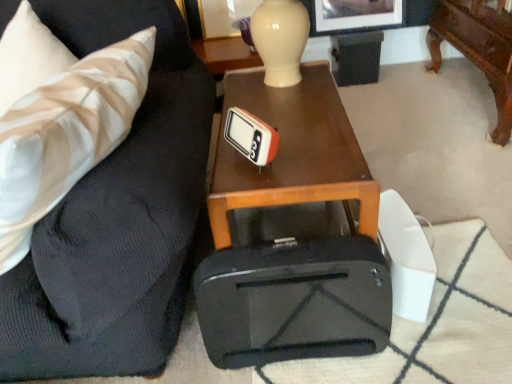
Question: Looking at their shapes, would you say woodenobject at center is wider or thinner than white striped fabric pillow at left?

Choices:
 (A) thin
 (B) wide

Answer: (A)

Question: Does point (215, 192) appear closer or farther from the camera than point (151, 44)?

Choices:
 (A) closer
 (B) farther

Answer: (A)

Question: Which object is positioned farthest from the woodenobject at center?

Choices:
 (A) white striped fabric pillow at left
 (B) white plastic thermometer at center
 (C) matte white picture frame at upper center, which appears as the first picture frame when viewed from the left
 (D) matte black picture frame at upper center, which is the 1th picture frame in right-to-left order
 (E) matte black suitcase at lower right

Answer: (C)

Question: Which object is the closest to the woodenobject at center?

Choices:
 (A) matte black suitcase at lower right
 (B) matte white picture frame at upper center, acting as the 2th picture frame starting from the right
 (C) black matte suitcase at center
 (D) matte black picture frame at upper center, which is the 1th picture frame in right-to-left order
 (E) white plastic thermometer at center

Answer: (E)